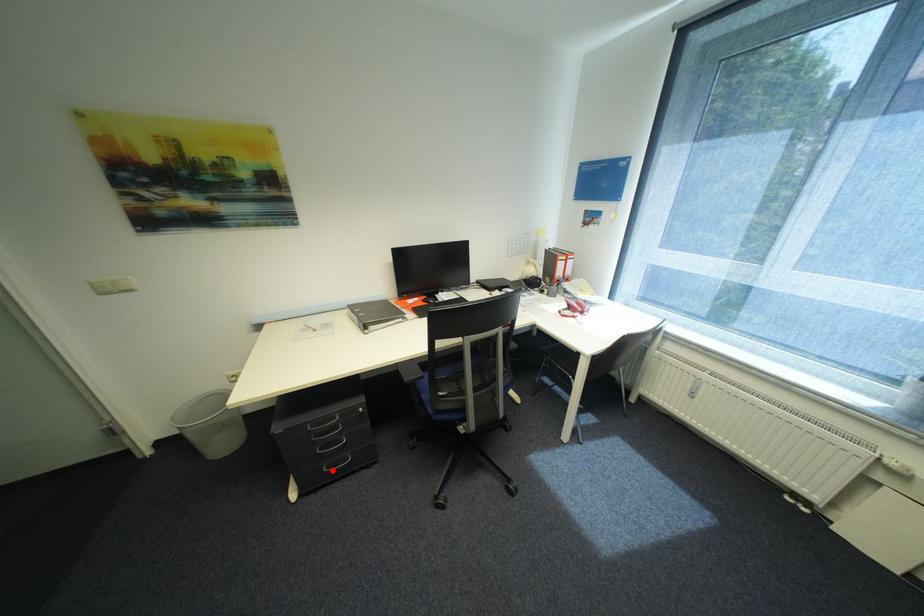
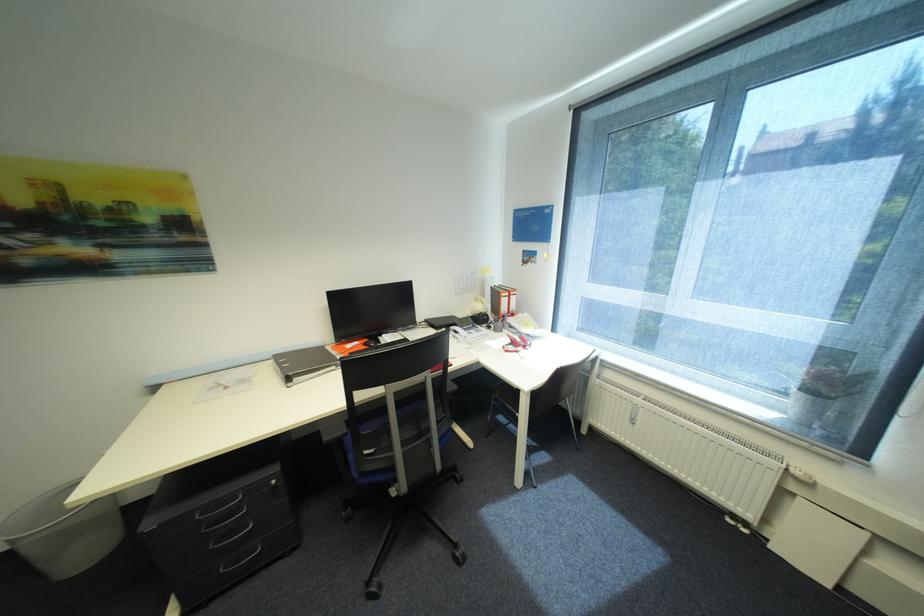
Locate, in the second image, the point that corresponds to the highlighted location in the first image.

(229, 570)